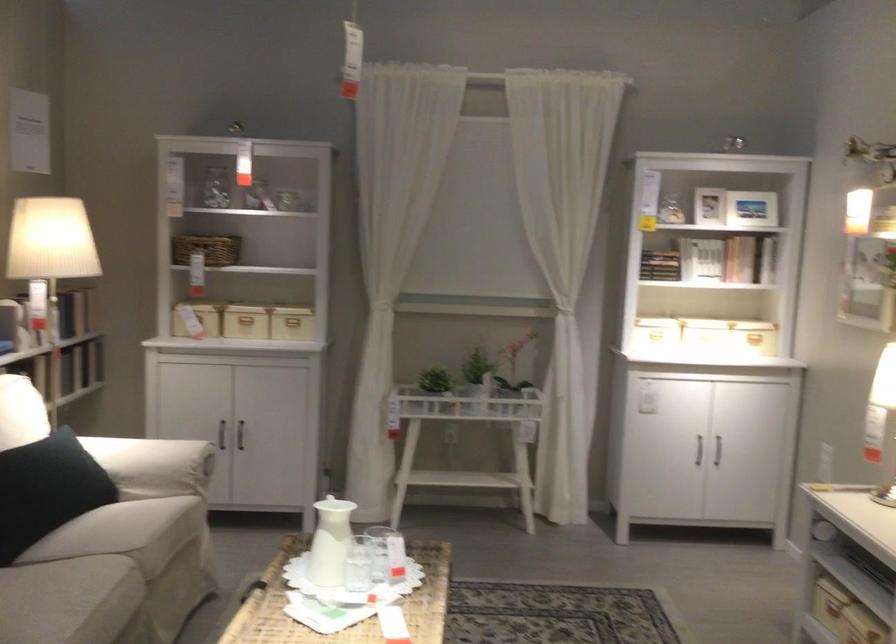
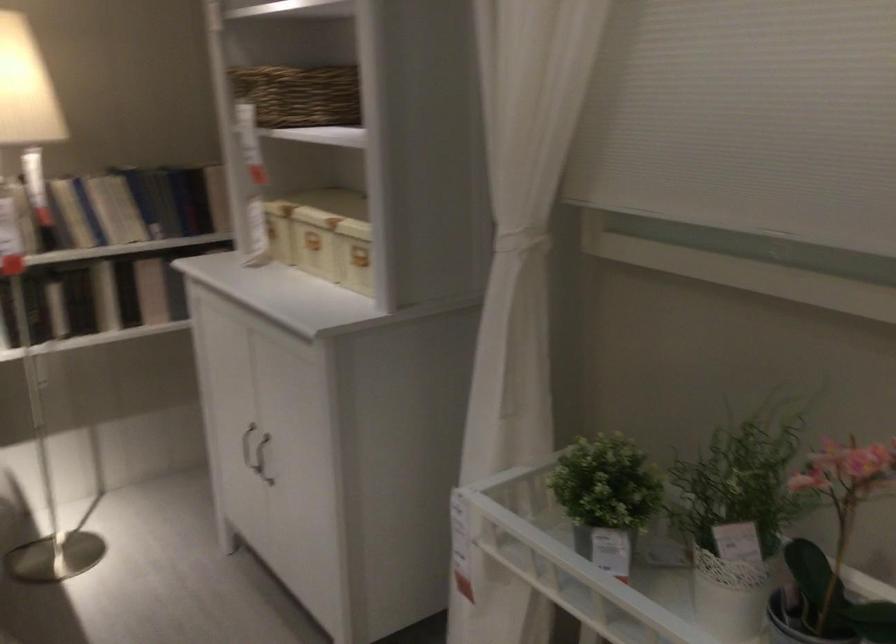
Find the pixel in the second image that matches (245,436) in the first image.

(262, 459)